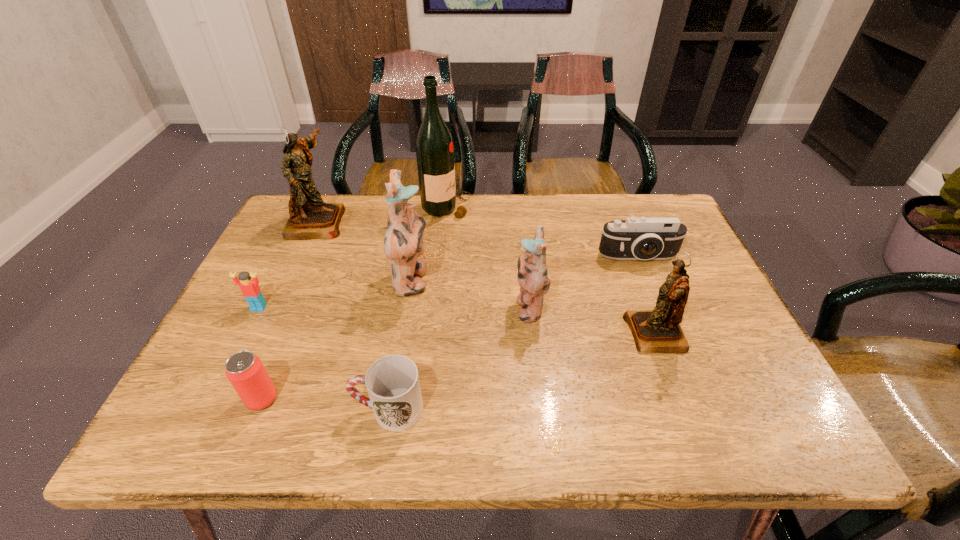
The height and width of the screenshot is (540, 960). Find the location of `wine bottle`. wine bottle is located at coordinates (434, 147).

Find the location of a particular element. green wine bottle is located at coordinates (434, 147).

This screenshot has width=960, height=540. What are the coordinates of `the farthest figurine` in the screenshot? It's located at (310, 218).

Locate an element on the screen. This screenshot has height=540, width=960. the bigger gold figurine is located at coordinates (310, 218).

Locate an element on the screen. The height and width of the screenshot is (540, 960). the second figurine from left to right is located at coordinates (403, 243).

Locate an element on the screen. the bigger pink figurine is located at coordinates point(403,243).

Where is `the nearer gold figurine`? the nearer gold figurine is located at coordinates (655, 331).

Where is `the rightmost figurine`? This screenshot has width=960, height=540. the rightmost figurine is located at coordinates click(655, 331).

Where is `the smaller pink figurine`? the smaller pink figurine is located at coordinates (532, 275).

Locate an element on the screen. Image resolution: width=960 pixels, height=540 pixels. the second figurine from right to left is located at coordinates [x=532, y=275].